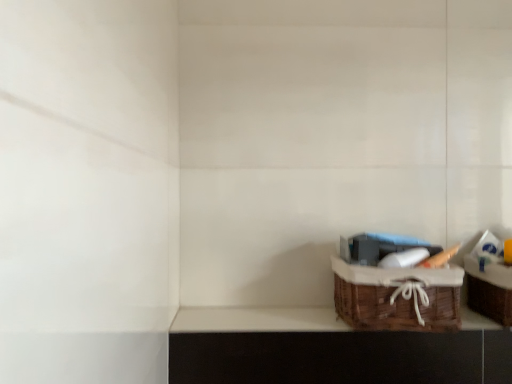
Question: Can you confirm if woven brown basket at lower right is smaller than brown wicker basket at lower right?

Choices:
 (A) no
 (B) yes

Answer: (A)

Question: Can you confirm if woven brown basket at lower right is positioned to the right of brown wicker basket at lower right?

Choices:
 (A) no
 (B) yes

Answer: (B)

Question: From the image's perspective, does woven brown basket at lower right appear lower than brown wicker basket at lower right?

Choices:
 (A) yes
 (B) no

Answer: (B)

Question: From a real-world perspective, is woven brown basket at lower right below brown wicker basket at lower right?

Choices:
 (A) no
 (B) yes

Answer: (A)

Question: Does woven brown basket at lower right have a larger size compared to brown wicker basket at lower right?

Choices:
 (A) no
 (B) yes

Answer: (B)

Question: In the image, is woven brown basket at lower right positioned in front of or behind brown wicker basket at lower right?

Choices:
 (A) front
 (B) behind

Answer: (A)

Question: Does point (466, 263) appear closer or farther from the camera than point (297, 309)?

Choices:
 (A) closer
 (B) farther

Answer: (A)

Question: From the image's perspective, relative to brown wicker basket at lower right, is woven brown basket at lower right above or below?

Choices:
 (A) below
 (B) above

Answer: (B)

Question: Visually, is woven brown basket at lower right positioned to the left or to the right of brown wicker basket at lower right?

Choices:
 (A) left
 (B) right

Answer: (B)

Question: Is brown wicker basket at lower right situated inside woven brown basket at lower right or outside?

Choices:
 (A) inside
 (B) outside

Answer: (B)

Question: In terms of height, does brown wicker basket at lower right look taller or shorter compared to woven brown basket at lower right?

Choices:
 (A) short
 (B) tall

Answer: (A)

Question: From a real-world perspective, relative to woven brown basket at lower right, is brown wicker basket at lower right vertically above or below?

Choices:
 (A) above
 (B) below

Answer: (B)

Question: Is brown wicker basket at lower right to the left or to the right of woven brown basket at lower right in the image?

Choices:
 (A) left
 (B) right

Answer: (A)

Question: Considering the positions of woven brown basket at lower right and woven brown picnic basket at lower right in the image, is woven brown basket at lower right taller or shorter than woven brown picnic basket at lower right?

Choices:
 (A) tall
 (B) short

Answer: (A)

Question: Visually, is woven brown basket at lower right positioned to the left or to the right of woven brown picnic basket at lower right?

Choices:
 (A) left
 (B) right

Answer: (B)